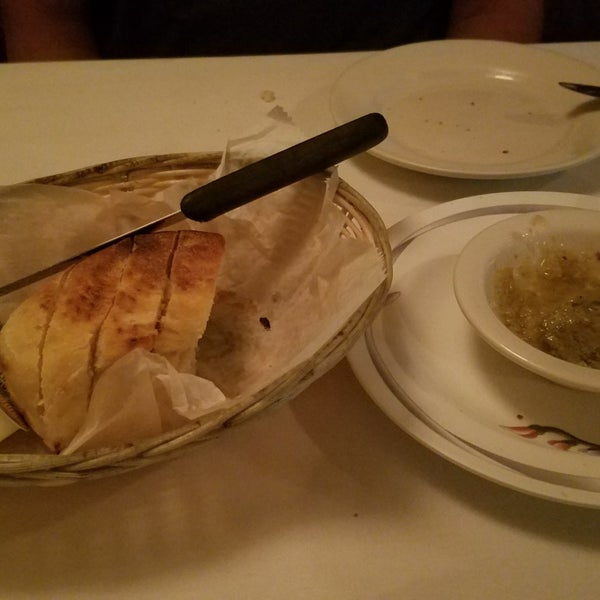
The height and width of the screenshot is (600, 600). Find the location of `plates`. plates is located at coordinates (491, 127), (445, 344).